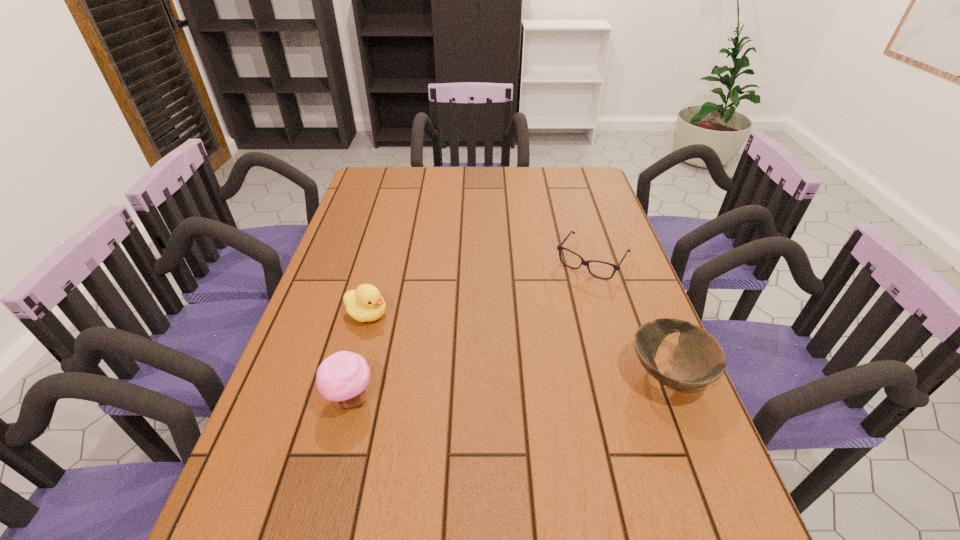
Locate an element on the screen. This screenshot has width=960, height=540. vacant space on the desktop that is between the cupcake and the bowl and is positioned on the front-facing side of the spectacles is located at coordinates (506, 387).

The image size is (960, 540). I want to click on vacant space on the desktop that is between the tallest object and the bowl and is positioned on the beak of the duckling, so click(x=533, y=385).